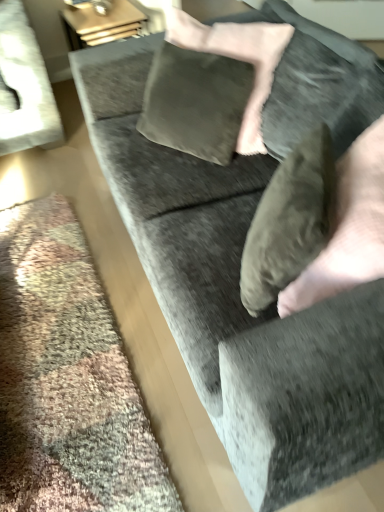
In order to face suede-like tan hand at lower right, should I rotate leftwards or rightwards?

A 20.810 degree turn to the right will do.

This screenshot has height=512, width=384. What do you see at coordinates (348, 228) in the screenshot? I see `suede-like tan hand at lower right` at bounding box center [348, 228].

At what (x,y) coordinates should I click in order to perform the action: click on suede-like tan hand at lower right. Please return your answer as a coordinate pair (x, y). The image size is (384, 512). Looking at the image, I should click on (348, 228).

Measure the distance between suede-like tan hand at lower right and camera.

A distance of 32.73 inches exists between suede-like tan hand at lower right and camera.

In order to face velvet gray pillow at center, should I rotate leftwards or rightwards?

You should rotate right by 12.321 degrees.

Describe the element at coordinates (289, 221) in the screenshot. The image size is (384, 512). I see `velvet gray pillow at center` at that location.

Where is `velvet gray pillow at center`? The height and width of the screenshot is (512, 384). velvet gray pillow at center is located at coordinates (289, 221).

Find the location of a particular element. suede-like tan hand at lower right is located at coordinates (348, 228).

Considering the positions of objects suede-like tan hand at lower right and velvet gray pillow at center in the image provided, who is more to the right, suede-like tan hand at lower right or velvet gray pillow at center?

Positioned to the right is suede-like tan hand at lower right.

Is the position of suede-like tan hand at lower right less distant than that of velvet gray pillow at center?

Yes.

Is point (285, 290) behind point (259, 213)?

No, (285, 290) is closer to viewer.

From the image's perspective, which object appears higher, suede-like tan hand at lower right or velvet gray pillow at center?

velvet gray pillow at center appears higher in the image.

From a real-world perspective, is suede-like tan hand at lower right beneath velvet gray pillow at center?

Yes, from a real-world perspective, suede-like tan hand at lower right is below velvet gray pillow at center.

Considering the sizes of objects suede-like tan hand at lower right and velvet gray pillow at center in the image provided, who is wider, suede-like tan hand at lower right or velvet gray pillow at center?

Wider between the two is suede-like tan hand at lower right.

Considering the relative sizes of suede-like tan hand at lower right and velvet gray pillow at center in the image provided, is suede-like tan hand at lower right taller than velvet gray pillow at center?

Indeed, suede-like tan hand at lower right has a greater height compared to velvet gray pillow at center.

Considering the sizes of objects suede-like tan hand at lower right and velvet gray pillow at center in the image provided, who is smaller, suede-like tan hand at lower right or velvet gray pillow at center?

velvet gray pillow at center.

Would you say suede-like tan hand at lower right is inside or outside velvet gray pillow at center?

suede-like tan hand at lower right lies outside velvet gray pillow at center.

Would you consider suede-like tan hand at lower right to be distant from velvet gray pillow at center?

Actually, suede-like tan hand at lower right and velvet gray pillow at center are a little close together.

Could you tell me if suede-like tan hand at lower right is facing velvet gray pillow at center?

Yes.

How many degrees apart are the facing directions of suede-like tan hand at lower right and velvet gray pillow at center?

6.77 degrees.

I want to click on hand below the velvet gray pillow at center (from the image's perspective), so click(x=348, y=228).

Looking at this image, does velvet gray pillow at center appear on the right side of suede-like tan hand at lower right?

Incorrect, velvet gray pillow at center is not on the right side of suede-like tan hand at lower right.

Is velvet gray pillow at center in front of or behind suede-like tan hand at lower right in the image?

Visually, velvet gray pillow at center is located behind suede-like tan hand at lower right.

Is point (297, 259) closer to camera compared to point (341, 212)?

Yes, it is.

From the image's perspective, is velvet gray pillow at center on top of suede-like tan hand at lower right?

Indeed, from the image's perspective, velvet gray pillow at center is shown above suede-like tan hand at lower right.

From a real-world perspective, is velvet gray pillow at center positioned under suede-like tan hand at lower right based on gravity?

No.

Considering the relative sizes of velvet gray pillow at center and suede-like tan hand at lower right in the image provided, is velvet gray pillow at center wider than suede-like tan hand at lower right?

No.

Considering the relative sizes of velvet gray pillow at center and suede-like tan hand at lower right in the image provided, is velvet gray pillow at center shorter than suede-like tan hand at lower right?

Yes, velvet gray pillow at center is shorter than suede-like tan hand at lower right.

Which of these two, velvet gray pillow at center or suede-like tan hand at lower right, is smaller?

With smaller size is velvet gray pillow at center.

Is velvet gray pillow at center outside of suede-like tan hand at lower right?

Actually, velvet gray pillow at center is within suede-like tan hand at lower right.

Would you consider velvet gray pillow at center to be distant from suede-like tan hand at lower right?

No, there isn't a large distance between velvet gray pillow at center and suede-like tan hand at lower right.

Could you tell me if velvet gray pillow at center is facing suede-like tan hand at lower right?

Yes, velvet gray pillow at center faces towards suede-like tan hand at lower right.

How many degrees apart are the facing directions of velvet gray pillow at center and suede-like tan hand at lower right?

6.77 degrees.

Looking at this image, how distant is velvet gray pillow at center from suede-like tan hand at lower right?

3.41 inches.

Find the location of a particular element. This screenshot has height=512, width=384. hand below the velvet gray pillow at center (from a real-world perspective) is located at coordinates pos(348,228).

You are a GUI agent. You are given a task and a screenshot of the screen. Output one action in this format:
    pyautogui.click(x=<x>, y=<y>)
    Task: Click on the pillow behind the suede-like tan hand at lower right
    This screenshot has width=384, height=512.
    Given the screenshot: What is the action you would take?
    pyautogui.click(x=289, y=221)

Locate an element on the screen. The width and height of the screenshot is (384, 512). hand on the right of velvet gray pillow at center is located at coordinates (348, 228).